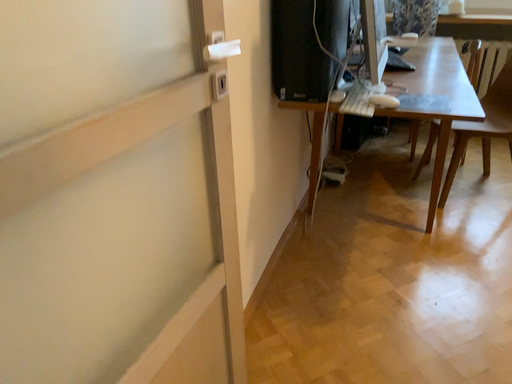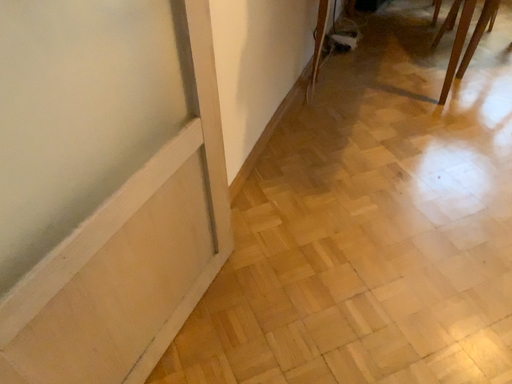
Question: Which way did the camera rotate in the video?

Choices:
 (A) rotated downward
 (B) rotated upward

Answer: (A)